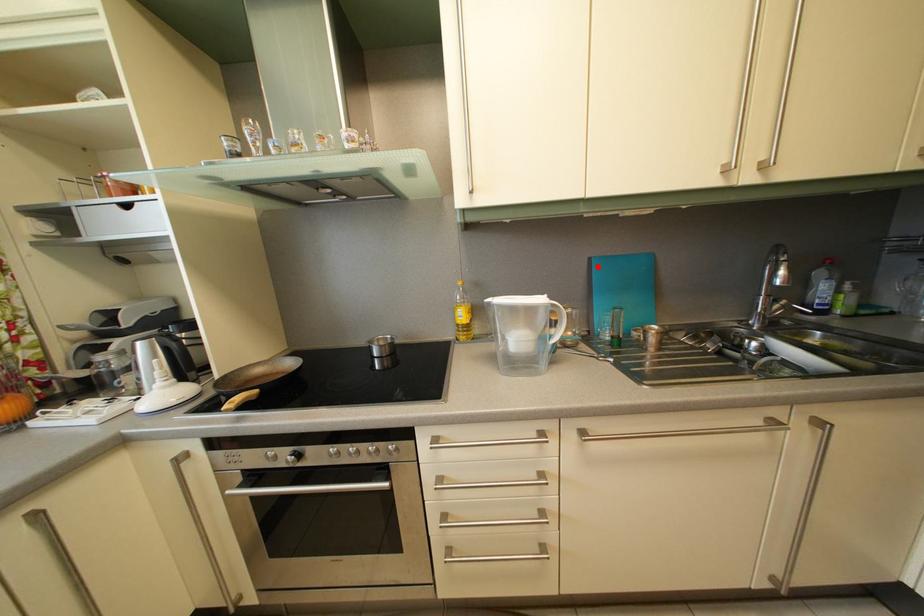
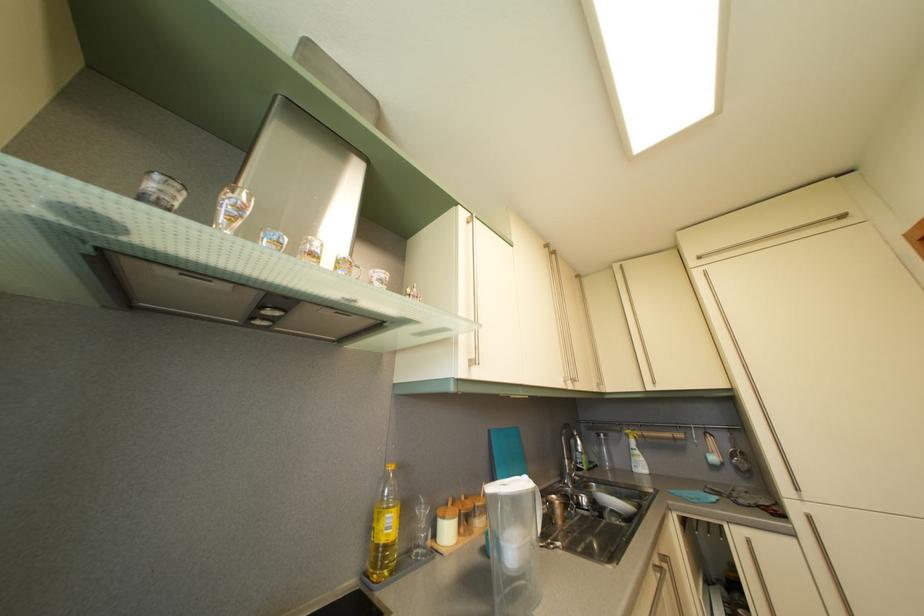
Question: I am providing you with two images of the same scene from different viewpoints. In image1, a red point is highlighted. Considering the same 3D point in image2, which of the following is correct?

Choices:
 (A) It is closer
 (B) It is farther

Answer: (B)